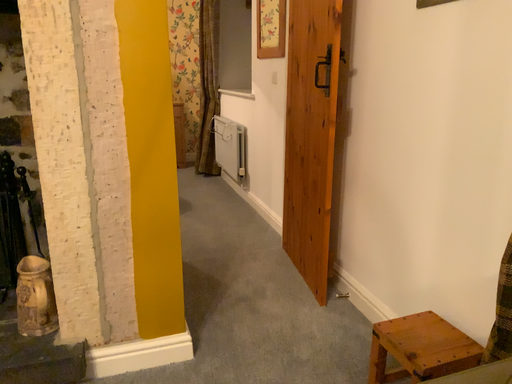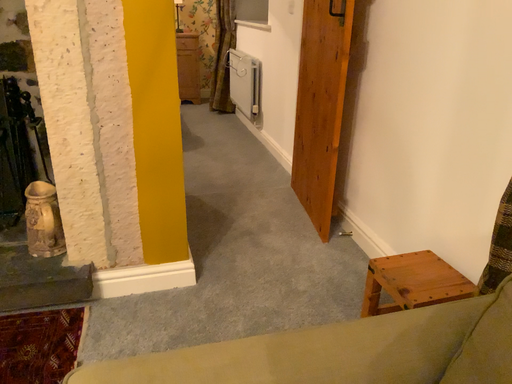
Question: Which way did the camera rotate in the video?

Choices:
 (A) rotated upward
 (B) rotated downward

Answer: (B)